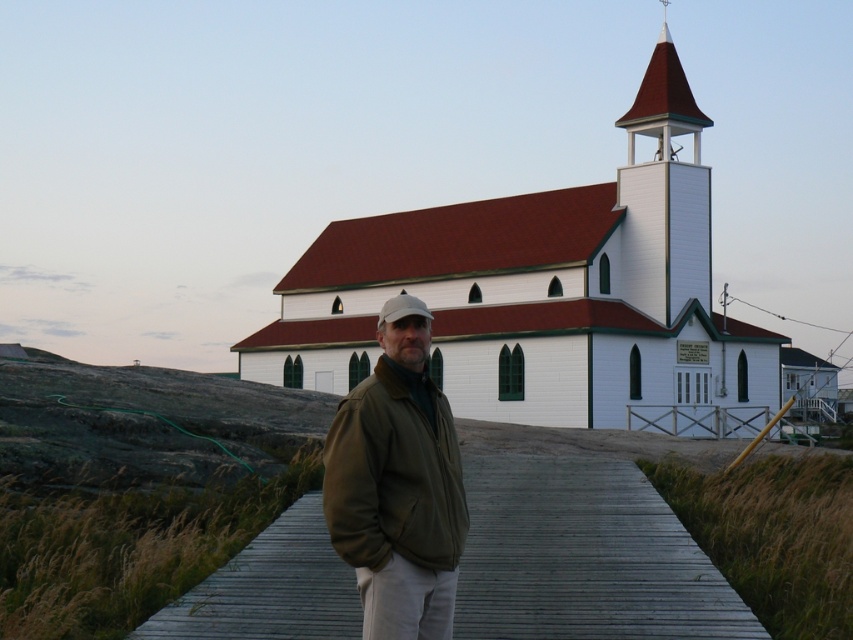
You are a photographer taking a picture of the white wood church at center and the matte brown jacket at center. Which object is positioned higher in the image?

The white wood church at center is positioned higher than the matte brown jacket at center in the image.

Based on the photo, you are a photographer trying to capture the man in the matte brown jacket at center and the white wood spire at upper right in the same frame. Based on their widths, will the jacket appear wider than the spire in the photo?

The matte brown jacket at center has a lesser width compared to the white wood spire at upper right, so the jacket will appear narrower than the spire in the photo.

You are a photographer planning to take a photo of the white wood church at center and the wooden at center. Based on their sizes, which object should you focus on to ensure it appears larger in the final image?

The white wood church at center has a greater height compared to wooden at center, so focusing on it will make it appear larger in the photo.